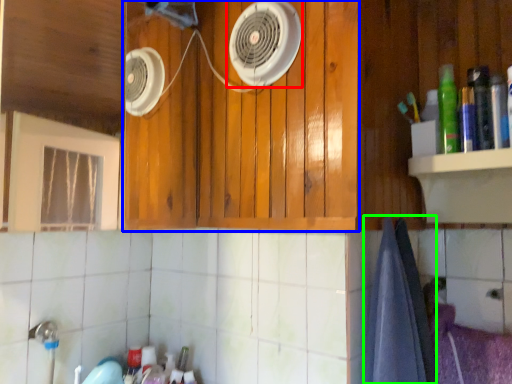
Question: Which is nearer to the home appliance (highlighted by a red box)? cabinetry (highlighted by a blue box) or bath towel (highlighted by a green box).

Choices:
 (A) cabinetry
 (B) bath towel

Answer: (A)